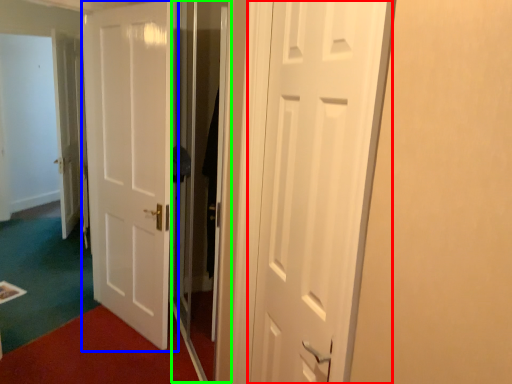
Question: Based on their relative distances, which object is nearer to door (highlighted by a red box)? Choose from door (highlighted by a blue box) and screen door (highlighted by a green box).

Choices:
 (A) door
 (B) screen door

Answer: (B)